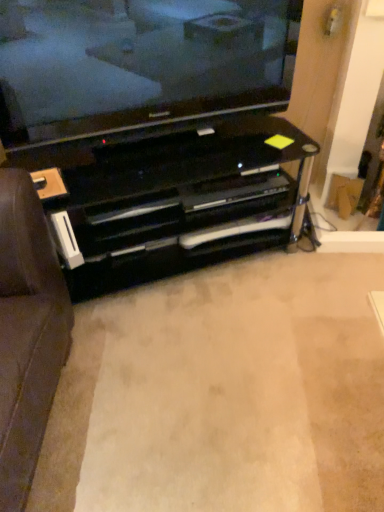
Question: Is black glossy entertainment center at center turned away from black glossy tv stand at center?

Choices:
 (A) yes
 (B) no

Answer: (B)

Question: Considering the relative sizes of black glossy entertainment center at center and black glossy tv stand at center in the image provided, is black glossy entertainment center at center shorter than black glossy tv stand at center?

Choices:
 (A) yes
 (B) no

Answer: (B)

Question: Is black glossy entertainment center at center to the left of black glossy tv stand at center from the viewer's perspective?

Choices:
 (A) yes
 (B) no

Answer: (A)

Question: Can you confirm if black glossy entertainment center at center is taller than black glossy tv stand at center?

Choices:
 (A) no
 (B) yes

Answer: (B)

Question: Can black glossy tv stand at center be found inside black glossy entertainment center at center?

Choices:
 (A) yes
 (B) no

Answer: (B)

Question: Considering the positions of black glossy tv stand at center and black glossy entertainment center at center in the image, is black glossy tv stand at center bigger or smaller than black glossy entertainment center at center?

Choices:
 (A) big
 (B) small

Answer: (B)

Question: From the image's perspective, is black glossy tv stand at center located above or below black glossy entertainment center at center?

Choices:
 (A) below
 (B) above

Answer: (A)

Question: In terms of width, does black glossy tv stand at center look wider or thinner when compared to black glossy entertainment center at center?

Choices:
 (A) wide
 (B) thin

Answer: (A)

Question: From their relative heights in the image, would you say black glossy tv stand at center is taller or shorter than black glossy entertainment center at center?

Choices:
 (A) tall
 (B) short

Answer: (B)

Question: Considering the relative positions of black glass television at upper center and black glossy entertainment center at center in the image provided, is black glass television at upper center to the left or to the right of black glossy entertainment center at center?

Choices:
 (A) left
 (B) right

Answer: (B)

Question: From the image's perspective, is black glass television at upper center located above or below black glossy entertainment center at center?

Choices:
 (A) below
 (B) above

Answer: (B)

Question: From a real-world perspective, is black glass television at upper center physically located above or below black glossy entertainment center at center?

Choices:
 (A) above
 (B) below

Answer: (A)

Question: Looking at the image, does black glass television at upper center seem bigger or smaller compared to black glossy entertainment center at center?

Choices:
 (A) big
 (B) small

Answer: (B)

Question: Considering the positions of point (329, 311) and point (130, 98), is point (329, 311) closer or farther from the camera than point (130, 98)?

Choices:
 (A) farther
 (B) closer

Answer: (A)

Question: Is black glossy tv stand at center bigger or smaller than black glass television at upper center?

Choices:
 (A) big
 (B) small

Answer: (B)